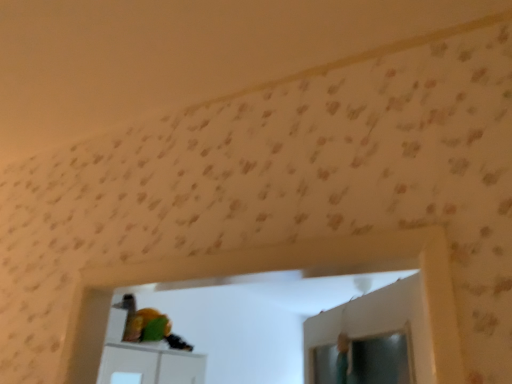
Where is `green matte parrot at center`? This screenshot has width=512, height=384. green matte parrot at center is located at coordinates (148, 325).

This screenshot has width=512, height=384. What do you see at coordinates (148, 325) in the screenshot?
I see `green matte parrot at center` at bounding box center [148, 325].

Identify the location of green matte parrot at center. The image size is (512, 384). (148, 325).